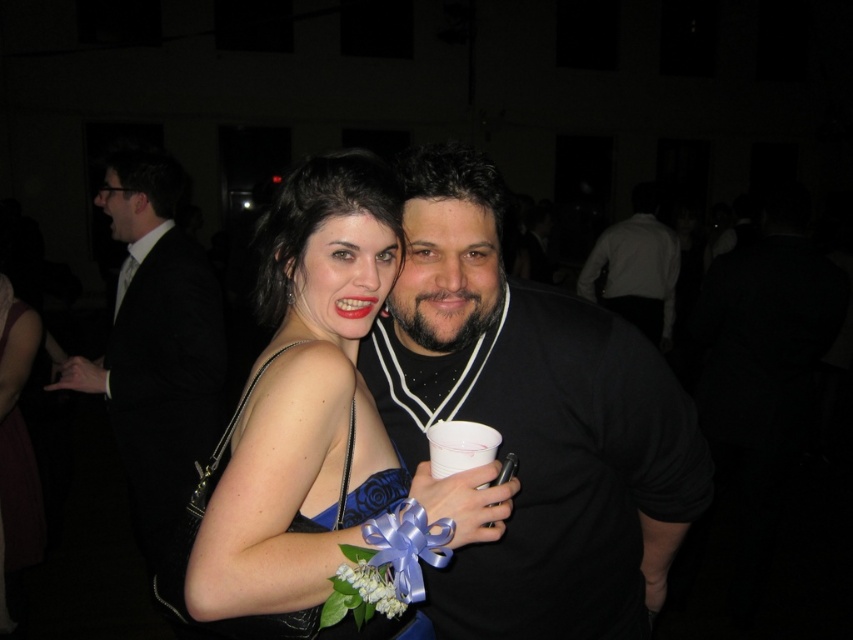
In the image of the formal event, there is a satin blue dress at center and a white shirt at upper center. From the perspective of someone standing in front of the scene, which object is positioned to the left?

The satin blue dress at center is to the left of the white shirt at upper center.

You are attending a formal event and notice two items of clothing in the scene. The satin blue dress at center and the white shirt at upper center. Which item of clothing appears shorter in height?

The satin blue dress at center is not as tall as the white shirt at upper center, so the satin blue dress at center appears shorter in height.

You are a photographer at a formal event. You want to capture a closeup shot of the black matte shirt at center and the satin blue dress at center. The camera you are using has a maximum focus range of 10 inches. Can you fit both subjects within the focus range?

The black matte shirt at center and satin blue dress at center are 9.77 inches apart, so yes, the camera can focus on both subjects since the distance between them is within the 10 inch range.